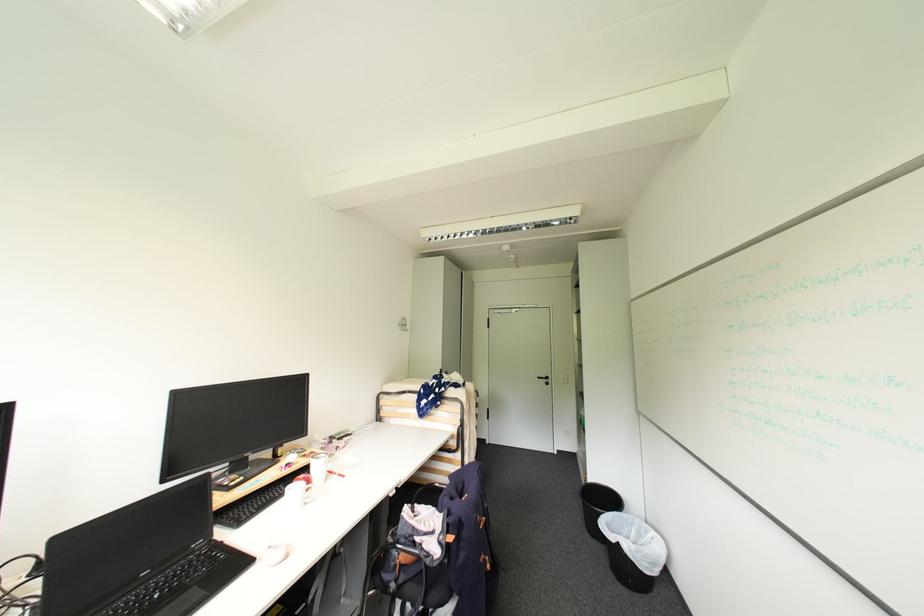
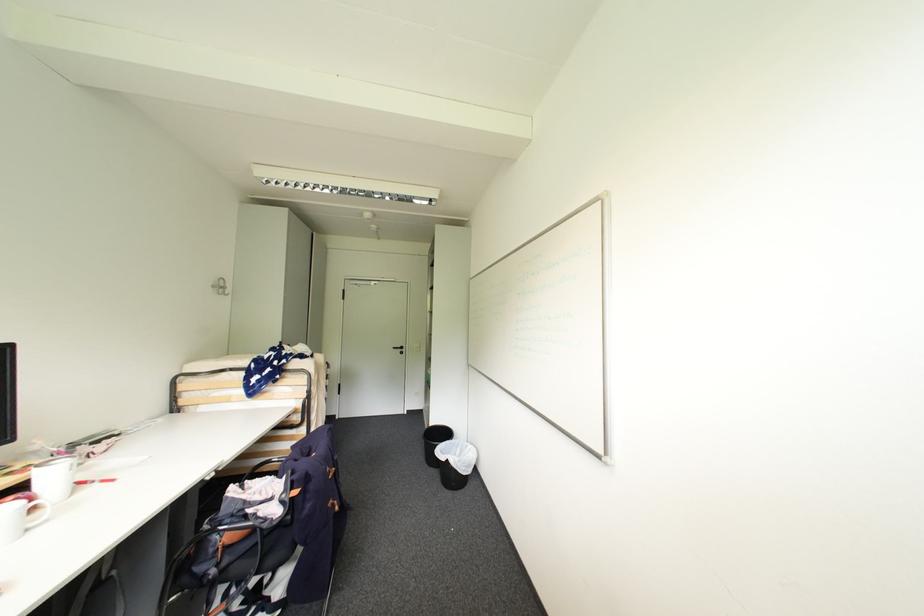
Locate, in the second image, the point that corresponds to point 624,514 in the first image.

(456, 442)